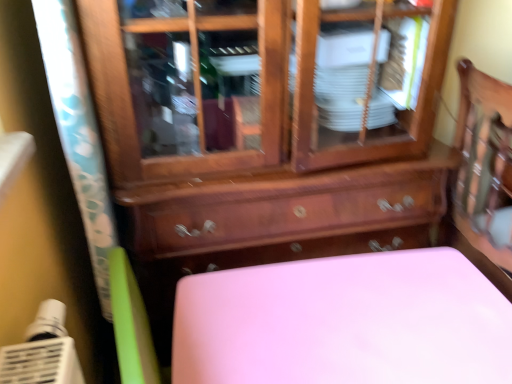
Find the location of a particular element. free space above pink matte table at lower center (from a real-world perspective) is located at coordinates (357, 319).